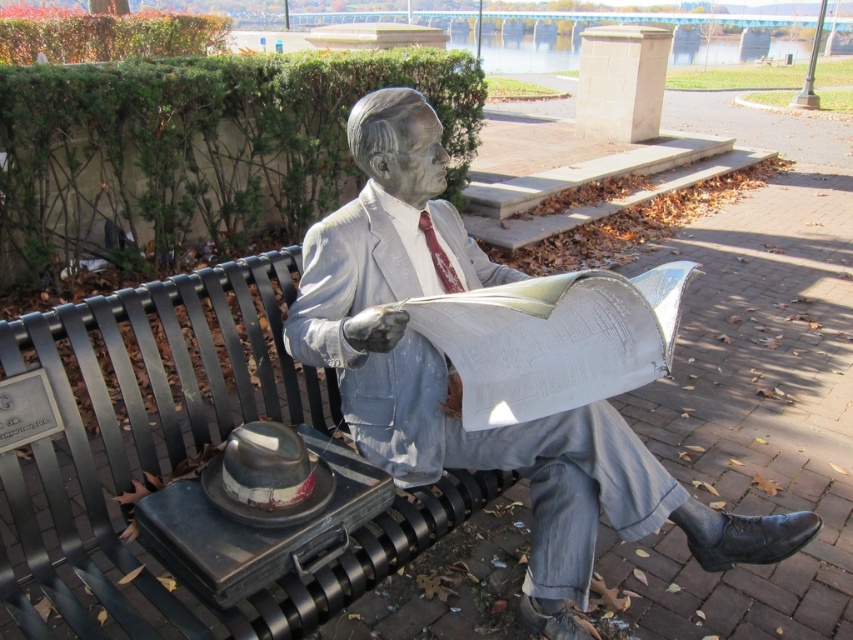
Which is behind, point (405, 332) or point (279, 465)?

The point (405, 332) is behind.

Is point (553, 419) closer to camera compared to point (297, 452)?

No.

At what (x,y) coordinates should I click in order to perform the action: click on gray stone statue at center. Please return your answer as a coordinate pair (x, y). This screenshot has width=853, height=640. Looking at the image, I should click on (460, 381).